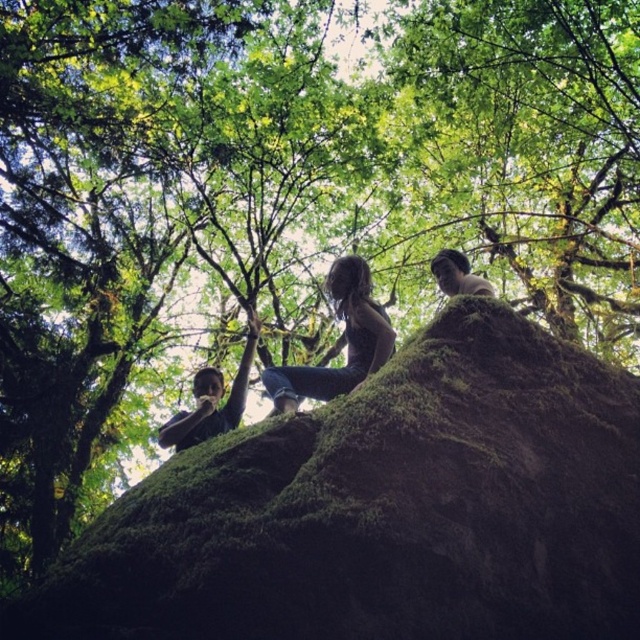
Who is lower down, green mossy rock at center or smooth brown hair at upper right?

green mossy rock at center is below.

Does green mossy rock at center appear on the right side of smooth brown hair at upper right?

No, green mossy rock at center is not to the right of smooth brown hair at upper right.

The image size is (640, 640). I want to click on green mossy rock at center, so click(384, 509).

Can you confirm if denim jeans at center is positioned above smooth brown hair at upper right?

No, denim jeans at center is not above smooth brown hair at upper right.

The width and height of the screenshot is (640, 640). What do you see at coordinates (339, 342) in the screenshot?
I see `denim jeans at center` at bounding box center [339, 342].

At what (x,y) coordinates should I click in order to perform the action: click on denim jeans at center. Please return your answer as a coordinate pair (x, y). Looking at the image, I should click on (339, 342).

Does dark brown leather jacket at center appear on the right side of smooth brown hair at upper right?

Incorrect, dark brown leather jacket at center is not on the right side of smooth brown hair at upper right.

Between point (200, 440) and point (448, 256), which one is positioned behind?

Point (448, 256)

Locate an element on the screen. Image resolution: width=640 pixels, height=640 pixels. dark brown leather jacket at center is located at coordinates (211, 401).